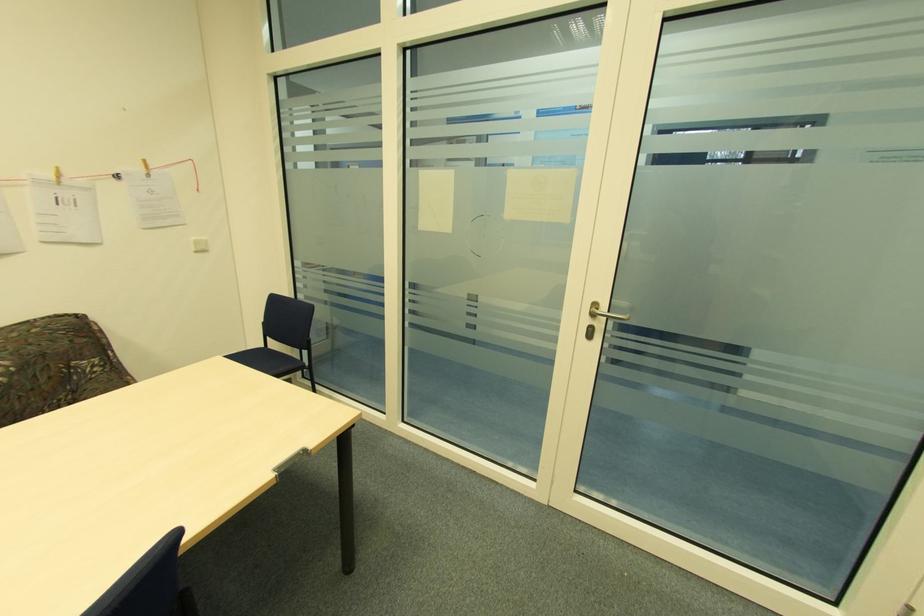
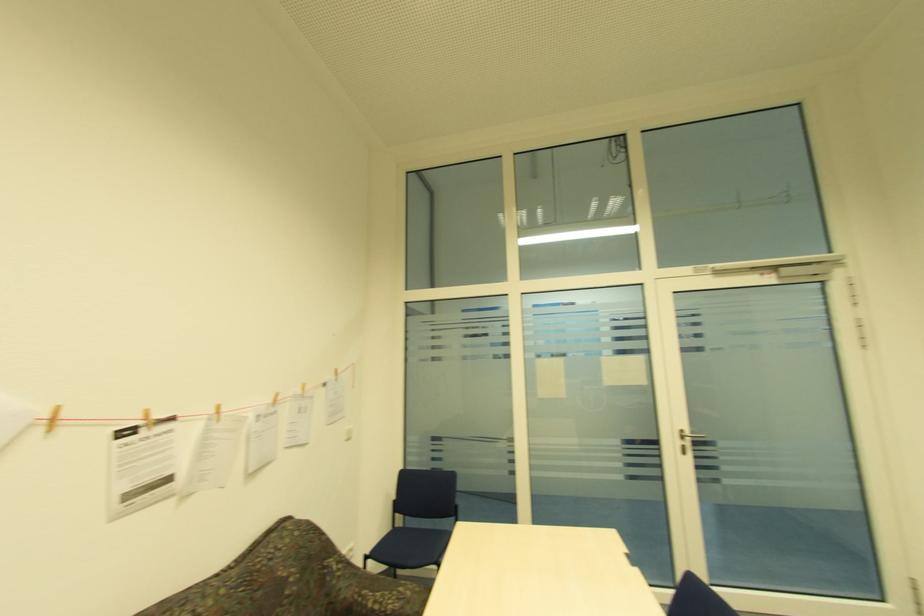
Find the pixel in the second image that matches pixel 598 304 in the first image.

(685, 432)